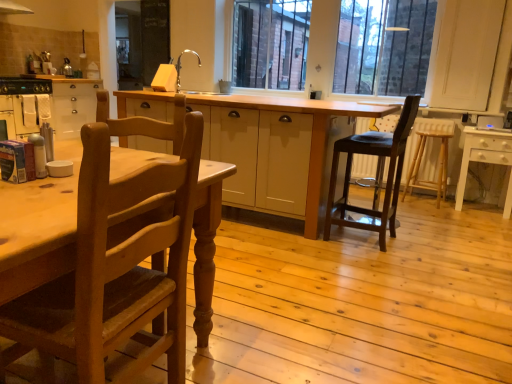
At what (x,y) coordinates should I click in order to perform the action: click on vacant area in front of dark brown wood stool at center-right, the second chair from the left. Please return your answer as a coordinate pair (x, y). The image size is (512, 384). Looking at the image, I should click on pos(374,264).